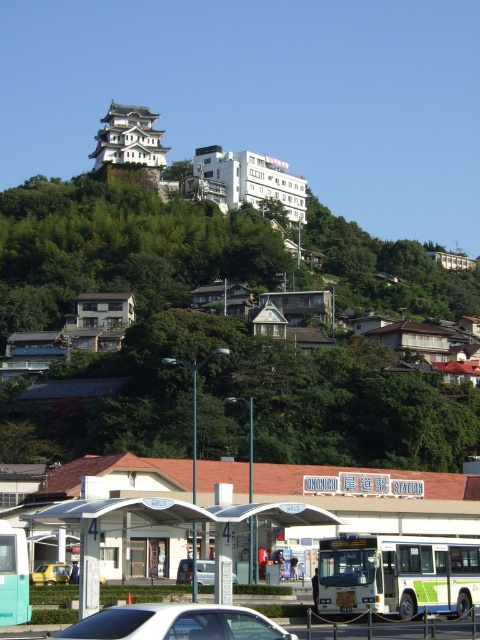
Question: Which point is closer to the camera?

Choices:
 (A) (200, 579)
 (B) (439, 532)
 (C) (50, 577)

Answer: (A)

Question: Does white metallic bus at lower center appear over white matte car at lower center?

Choices:
 (A) no
 (B) yes

Answer: (A)

Question: Among these points, which one is nearest to the camera?

Choices:
 (A) (115, 493)
 (B) (37, 579)
 (C) (466, 600)

Answer: (C)

Question: In this image, where is white metallic bus at lower center located relative to white matte car at lower center?

Choices:
 (A) right
 (B) left

Answer: (A)

Question: Which object is closer to the camera taking this photo?

Choices:
 (A) yellow matte taxi at lower left
 (B) white matte car at lower center
 (C) silver metallic van at center
 (D) white metallic bus at lower center

Answer: (B)

Question: Is white matte car at lower center to the left of silver metallic van at center from the viewer's perspective?

Choices:
 (A) no
 (B) yes

Answer: (B)